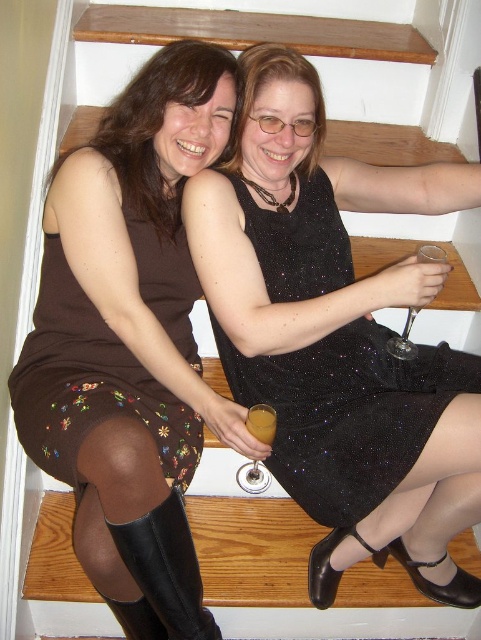
Question: Where is sparkly black dress at center located in relation to matte brown dress at upper left in the image?

Choices:
 (A) below
 (B) above

Answer: (A)

Question: Which object appears closest to the camera in this image?

Choices:
 (A) matte brown dress at upper left
 (B) brown sparkly dress at left
 (C) matte brown dress at center
 (D) amber glass at lower center

Answer: (C)

Question: Which point is farther to the camera?

Choices:
 (A) translucent glass at upper center
 (B) clear glass wine glass at center
 (C) matte brown dress at center

Answer: (A)

Question: Which object is the closest to the amber glass at lower center?

Choices:
 (A) black leather boot at lower left
 (B) sparkly black dress at center
 (C) matte brown dress at upper left
 (D) matte black dress at upper center

Answer: (B)

Question: Is matte brown dress at center to the right of clear glass wine glass at center from the viewer's perspective?

Choices:
 (A) yes
 (B) no

Answer: (B)

Question: Is amber glass at lower center thinner than translucent glass at upper center?

Choices:
 (A) no
 (B) yes

Answer: (A)